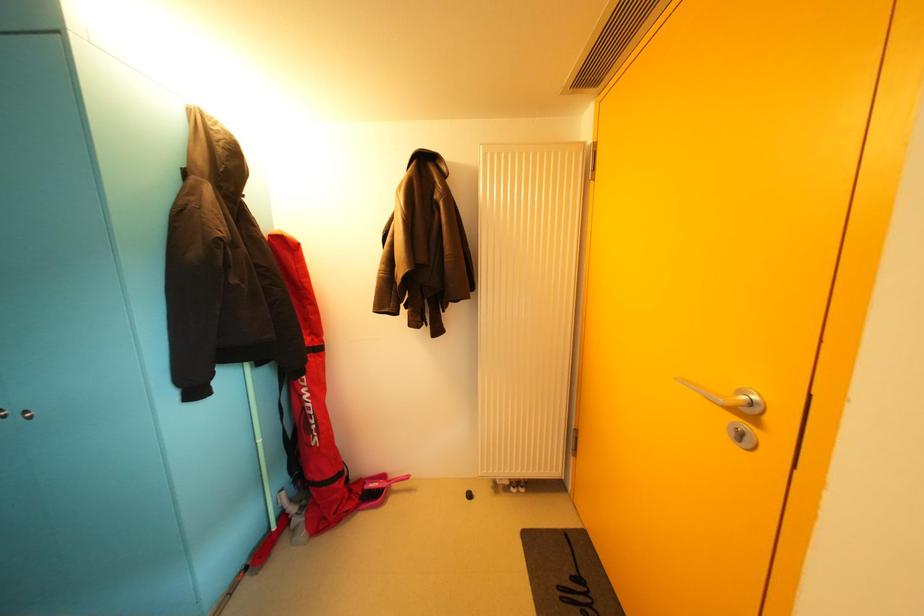
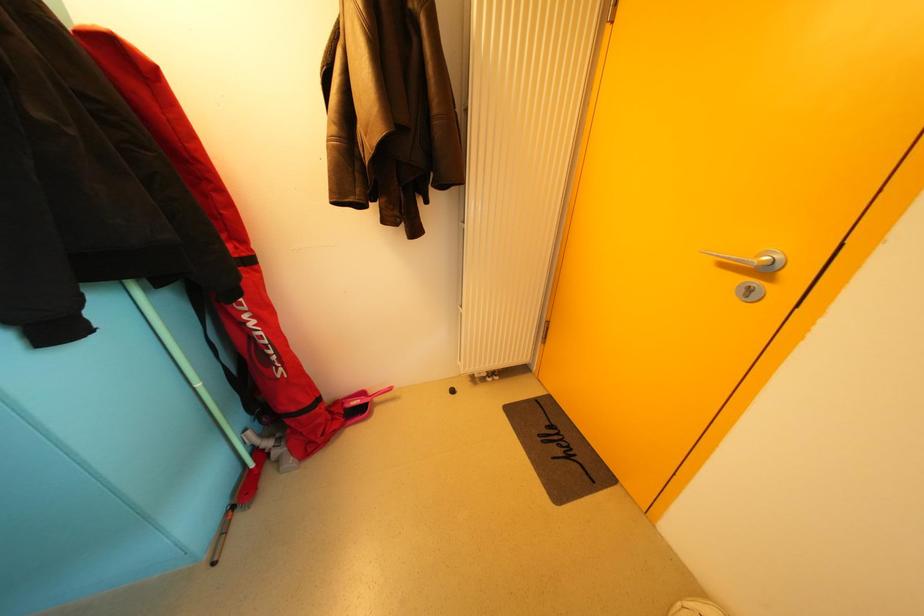
The first image is from the beginning of the video and the second image is from the end. How did the camera likely rotate when shooting the video?

The camera rotated toward right-down.